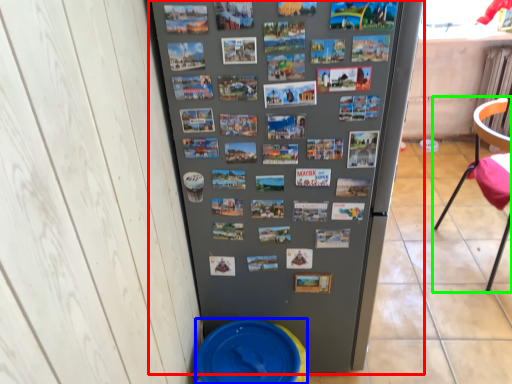
Question: Based on their relative distances, which object is farther from refrigerator (highlighted by a red box)? Choose from potty (highlighted by a blue box) and chair (highlighted by a green box).

Choices:
 (A) potty
 (B) chair

Answer: (B)